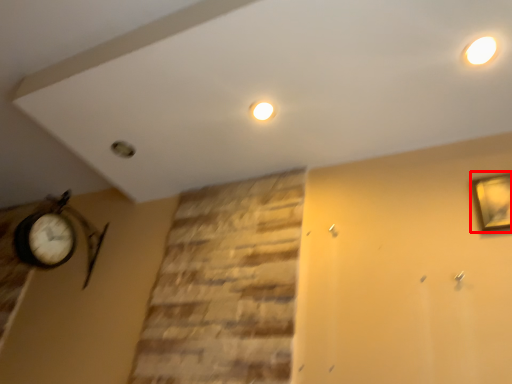
Question: In this image, where is picture frame (annotated by the red box) located relative to lighting?

Choices:
 (A) left
 (B) right

Answer: (B)